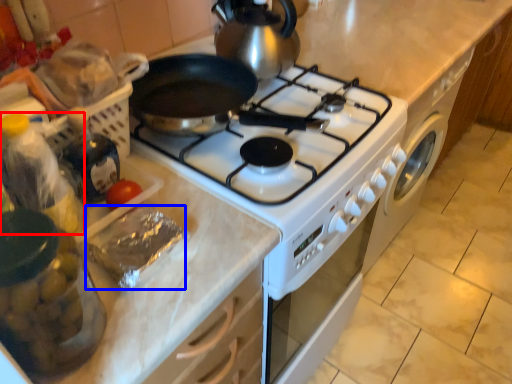
Question: Which object appears farthest to the camera in this image, bottle (highlighted by a red box) or food (highlighted by a blue box)?

Choices:
 (A) bottle
 (B) food

Answer: (B)